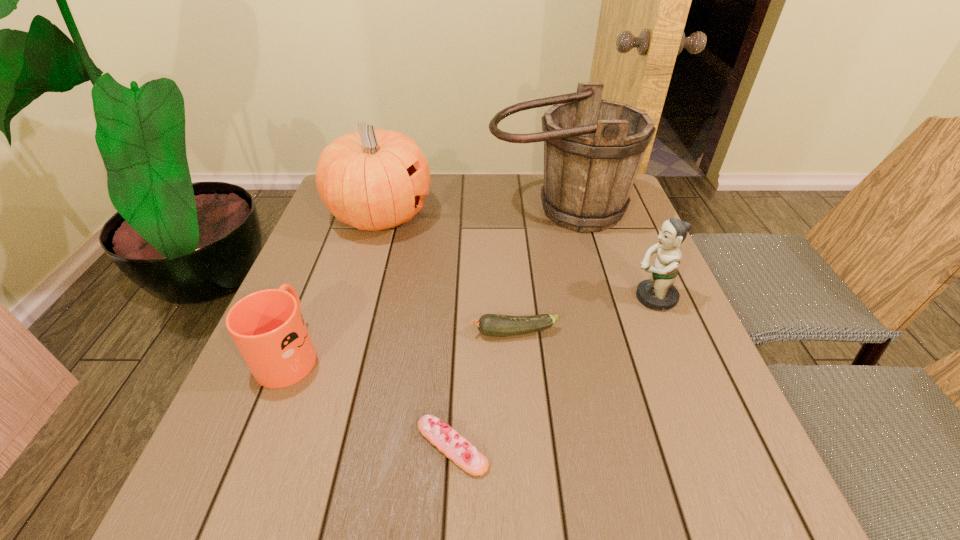
The height and width of the screenshot is (540, 960). What are the coordinates of `bucket` in the screenshot? It's located at (593, 148).

Find the location of a particular element. This screenshot has height=540, width=960. pumpkin is located at coordinates (370, 179).

The image size is (960, 540). What are the coordinates of `the fourth nearest object` in the screenshot? It's located at (658, 293).

Find the location of a particular element. The image size is (960, 540). the third tallest object is located at coordinates (658, 293).

Where is `the third shortest object`? The height and width of the screenshot is (540, 960). the third shortest object is located at coordinates (267, 326).

Where is `zucchini`? The image size is (960, 540). zucchini is located at coordinates (495, 325).

Find the location of `eclair`. eclair is located at coordinates (454, 446).

You are a GUI agent. You are given a task and a screenshot of the screen. Output one action in this format:
    pyautogui.click(x=<x>, y=<y>)
    Task: Click on the shortest object
    The image size is (960, 540).
    Given the screenshot: What is the action you would take?
    pyautogui.click(x=454, y=446)

Where is `free space located on the handle side of the bucket`? free space located on the handle side of the bucket is located at coordinates (590, 346).

Where is `vacant space located on the front-facing side of the pumpkin`? This screenshot has width=960, height=540. vacant space located on the front-facing side of the pumpkin is located at coordinates (453, 215).